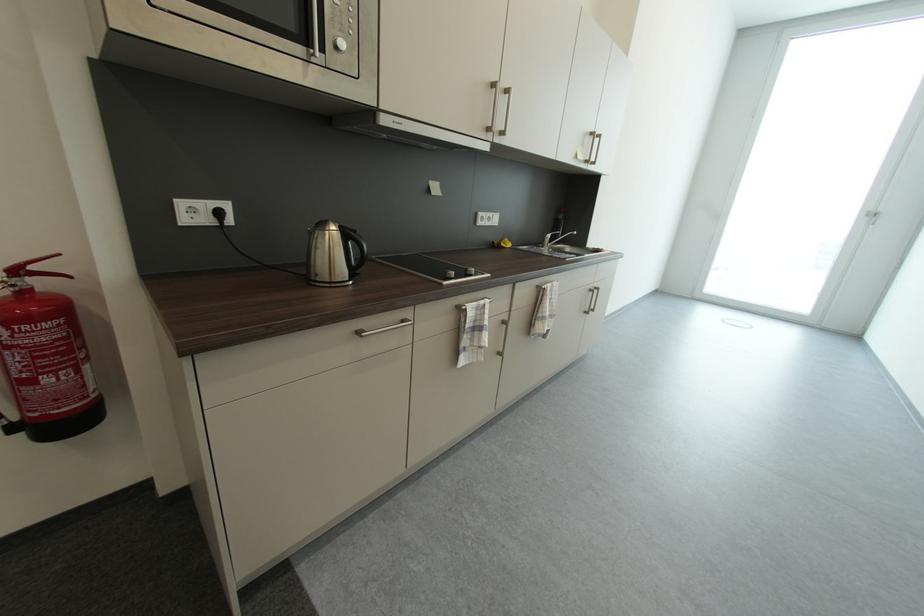
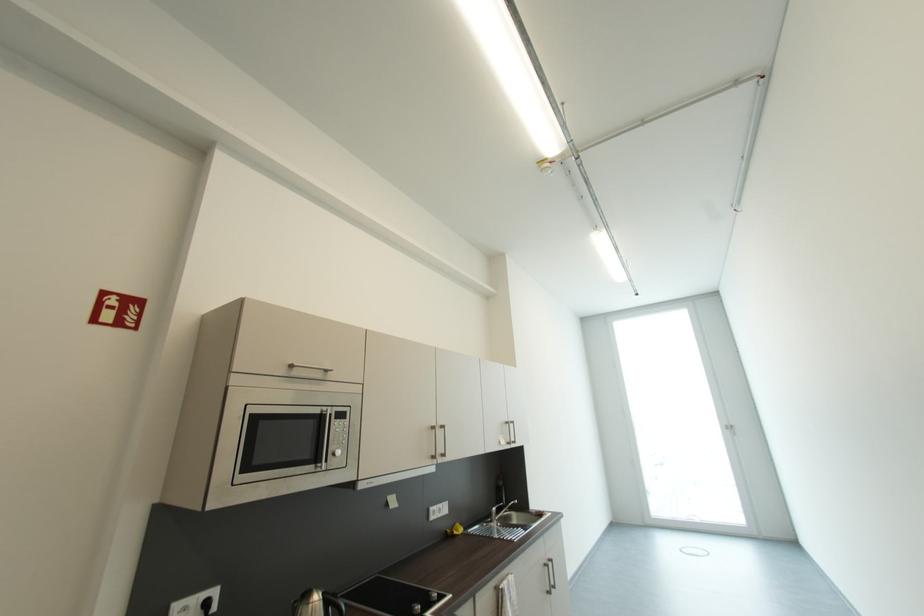
Locate, in the second image, the point that corresponds to [598,292] in the first image.

(552, 567)